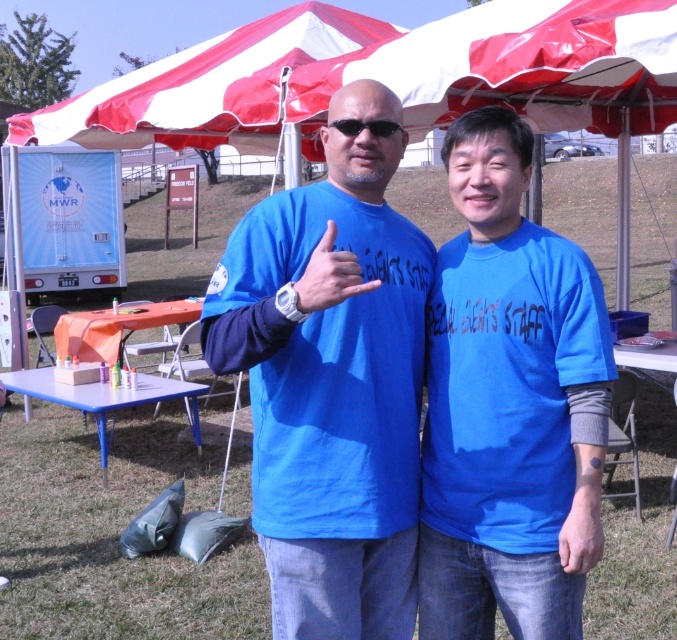
Question: Among these points, which one is farthest from the camera?

Choices:
 (A) (525, 435)
 (B) (299, 296)
 (C) (283, 33)

Answer: (C)

Question: Considering the relative positions of blue fabric hand at center and black plastic sunglasses at center in the image provided, where is blue fabric hand at center located with respect to black plastic sunglasses at center?

Choices:
 (A) above
 (B) below

Answer: (B)

Question: Which object is positioned farthest from the blue fabric hand at center?

Choices:
 (A) blue matte shirt at center
 (B) matte blue shirt at center
 (C) red/white fabric canopy at upper center

Answer: (C)

Question: Does matte blue shirt at center appear over black plastic sunglasses at center?

Choices:
 (A) no
 (B) yes

Answer: (A)

Question: Can you confirm if blue fabric hand at center is positioned to the right of black plastic sunglasses at center?

Choices:
 (A) no
 (B) yes

Answer: (A)

Question: Which point appears closest to the camera in this image?

Choices:
 (A) (452, 301)
 (B) (156, 81)

Answer: (A)